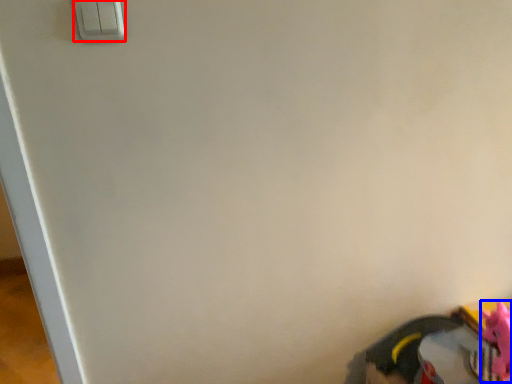
Question: Which point is further to the camera, light switch (highlighted by a red box) or toy (highlighted by a blue box)?

Choices:
 (A) light switch
 (B) toy

Answer: (B)